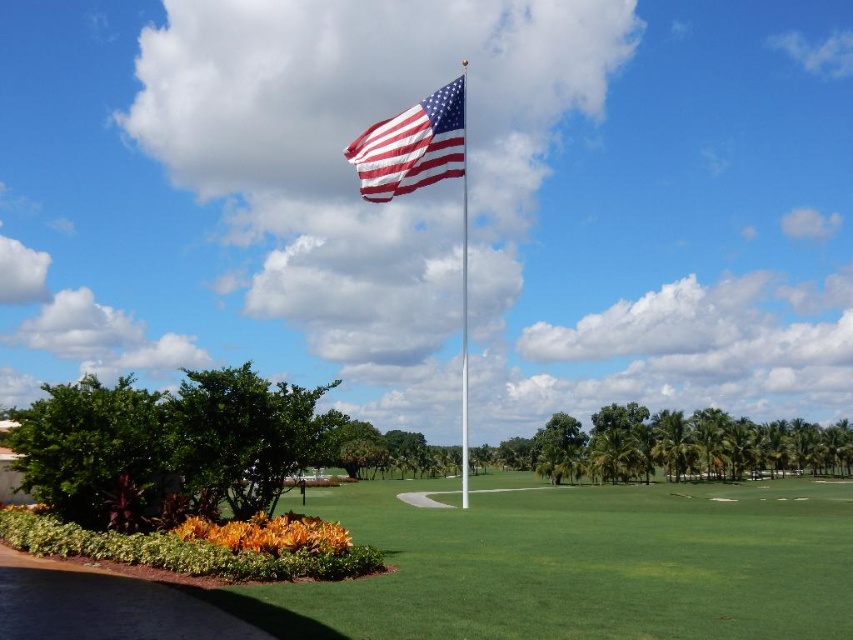
Question: Among these points, which one is farthest from the camera?

Choices:
 (A) (463, 323)
 (B) (498, 476)
 (C) (444, 176)

Answer: (B)

Question: Among these objects, which one is nearest to the camera?

Choices:
 (A) green grass at center
 (B) american flag at center

Answer: (A)

Question: Where is american flag at center located in relation to polished metal flag pole at center in the image?

Choices:
 (A) above
 (B) below

Answer: (B)

Question: Which point is closer to the camera?

Choices:
 (A) (361, 172)
 (B) (819, 588)

Answer: (B)

Question: Is green grass at center smaller than polished metal flag pole at center?

Choices:
 (A) yes
 (B) no

Answer: (A)

Question: From the image, what is the correct spatial relationship of american flag at center in relation to polished metal flag pole at center?

Choices:
 (A) right
 (B) left

Answer: (B)